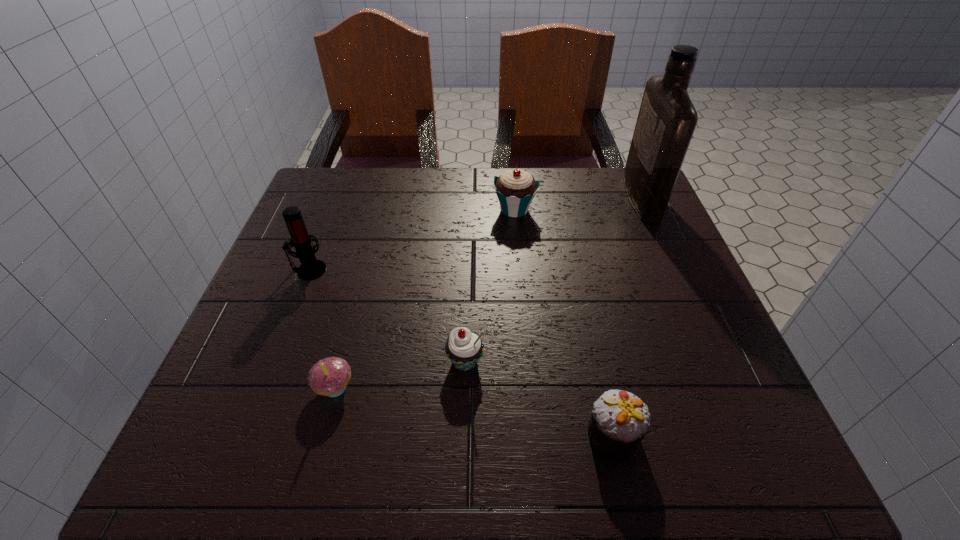
You are a GUI agent. You are given a task and a screenshot of the screen. Output one action in this format:
    pyautogui.click(x=<x>, y=<y>)
    Task: Click on the free spot between the fourth object from left to right and the nearest cupcake
    This screenshot has height=540, width=960.
    Given the screenshot: What is the action you would take?
    pyautogui.click(x=564, y=322)

Image resolution: width=960 pixels, height=540 pixels. What are the coordinates of `object that can be found as the fourth closest to the nearest cupcake` in the screenshot? It's located at (667, 118).

Select which object appears as the fifth closest to the leftmost cupcake. Please provide its 2D coordinates. Your answer should be formatted as a tuple, i.e. [(x, y)], where the tuple contains the x and y coordinates of a point satisfying the conditions above.

[(667, 118)]

In order to click on cupcake that is the second closest one to the rightmost object in this screenshot , I will do `click(620, 420)`.

Where is `cupcake that stands as the closest to the leftmost cupcake`? cupcake that stands as the closest to the leftmost cupcake is located at coordinates (464, 348).

Locate an element on the screen. The height and width of the screenshot is (540, 960). blank area in the image that satisfies the following two spatial constraints: 1. on the back side of the fourth object from left to right; 2. on the left side of the third farthest object is located at coordinates (333, 210).

What are the coordinates of `free space in the image that satisfies the following two spatial constraints: 1. on the label side of the tallest object; 2. on the front side of the farthest cupcake` in the screenshot? It's located at (646, 210).

At what (x,y) coordinates should I click in order to perform the action: click on vacant position in the image that satisfies the following two spatial constraints: 1. on the label side of the rightmost object; 2. on the front side of the second object from left to right. Please return your answer as a coordinate pair (x, y). The width and height of the screenshot is (960, 540). Looking at the image, I should click on (726, 387).

Locate an element on the screen. Image resolution: width=960 pixels, height=540 pixels. blank area in the image that satisfies the following two spatial constraints: 1. on the label side of the rightmost object; 2. on the front side of the second object from right to left is located at coordinates (746, 434).